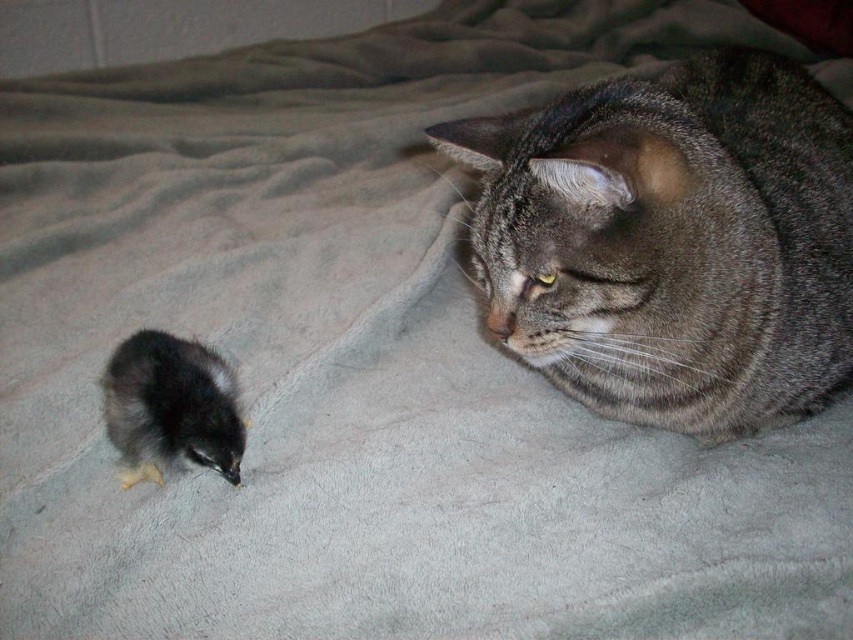
You are a photographer trying to capture a closeup of both the gray tabby cat at upper right and the fluffy black bird at lower left in the scene. Given their sizes, which one requires more space in the frame to fully capture?

The gray taby cat at upper right requires more space in the frame because its width surpasses that of the fluffy black bird at lower left.

You are a photographer trying to capture the gray tabby cat at upper right in the center of your photo. Given its current position at point 0.378, 0.789, what adjustment should you make to the camera frame to center the cat?

To center the gray tabby cat at upper right, adjust the camera frame so that its position moves from point (x=672, y=241) to the center coordinates of the image, which is typically at point (x=426, y=320). This requires shifting the frame slightly to the left and downward.